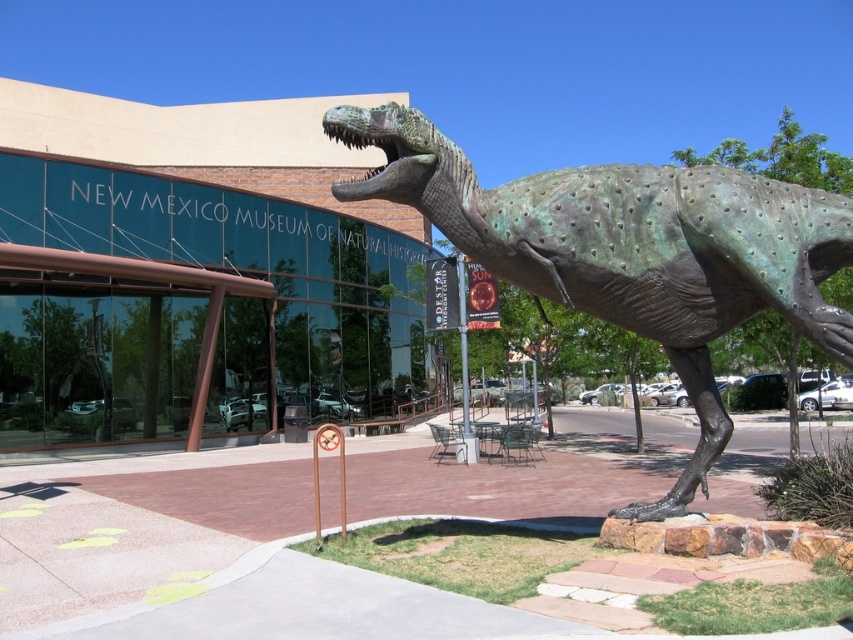
Is green glass building at center taller than green patina dinosaur at center?

Indeed, green glass building at center has a greater height compared to green patina dinosaur at center.

Where is `green glass building at center`? green glass building at center is located at coordinates [x=196, y=269].

The image size is (853, 640). Identify the location of green glass building at center. (196, 269).